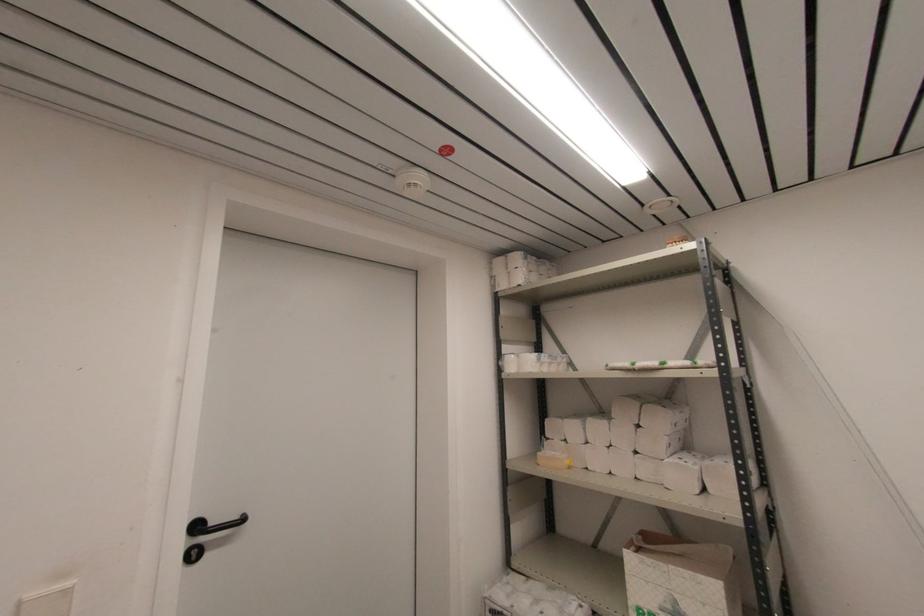
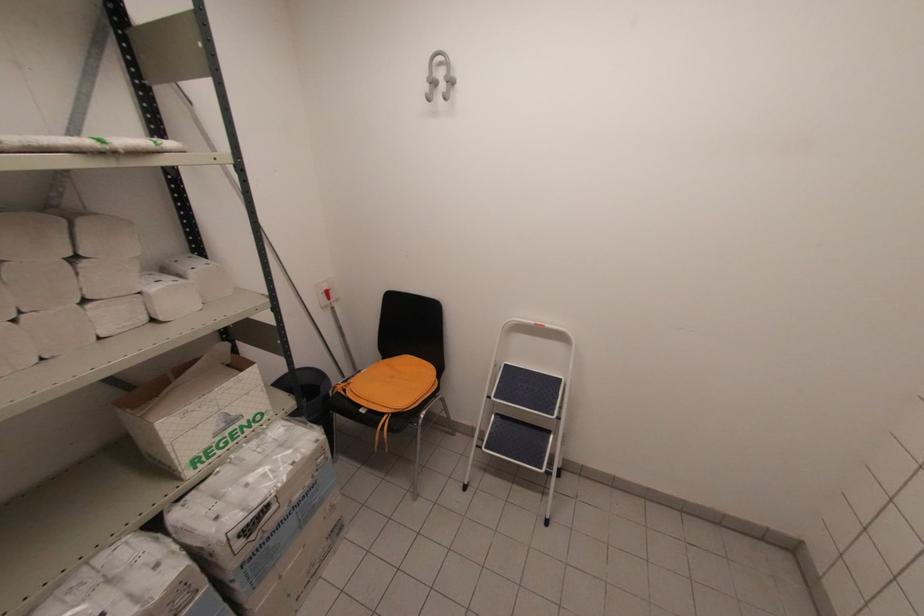
In the second image, find the point that corresponds to point 638,424 in the first image.

(71, 254)